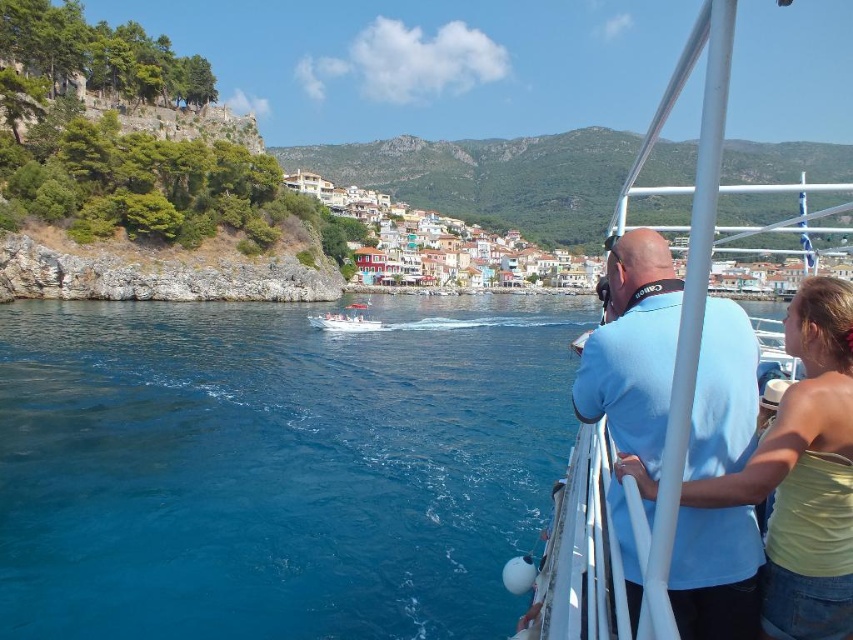
Question: Which object is farther from the camera taking this photo?

Choices:
 (A) white plastic boat at right
 (B) yellow matte tank top at right
 (C) light blue cotton shirt at upper right
 (D) white plastic boat at center

Answer: (D)

Question: Among these points, which one is farthest from the camera?

Choices:
 (A) (679, 420)
 (B) (834, 532)

Answer: (B)

Question: Which of these objects is positioned closest to the yellow matte tank top at right?

Choices:
 (A) white plastic boat at center
 (B) light blue cotton shirt at upper right
 (C) white plastic boat at right

Answer: (B)

Question: Observing the image, what is the correct spatial positioning of white plastic boat at right in reference to white plastic boat at center?

Choices:
 (A) below
 (B) above

Answer: (A)

Question: Considering the relative positions of white plastic boat at right and white plastic boat at center in the image provided, where is white plastic boat at right located with respect to white plastic boat at center?

Choices:
 (A) below
 (B) above

Answer: (A)

Question: Does white plastic boat at right have a lesser width compared to light blue cotton shirt at upper right?

Choices:
 (A) no
 (B) yes

Answer: (A)